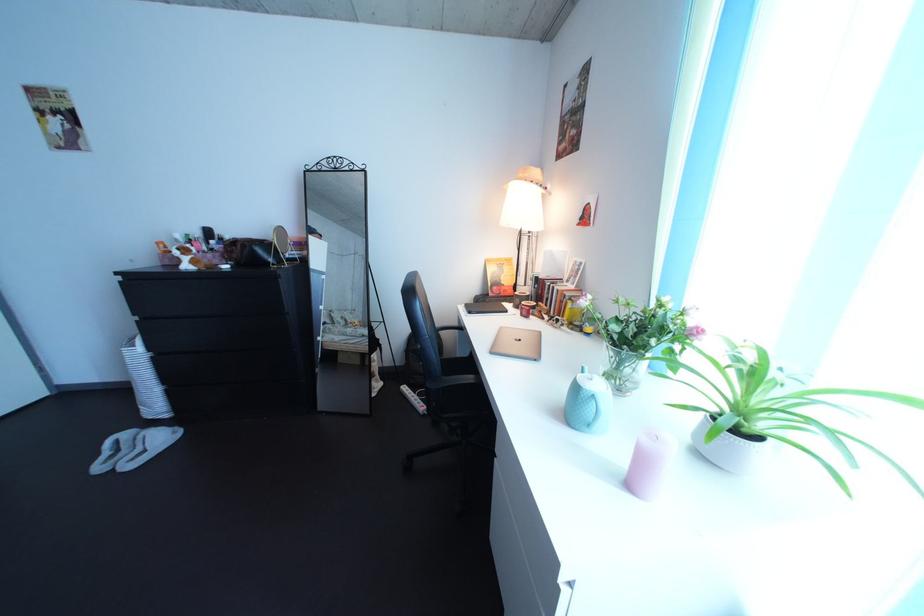
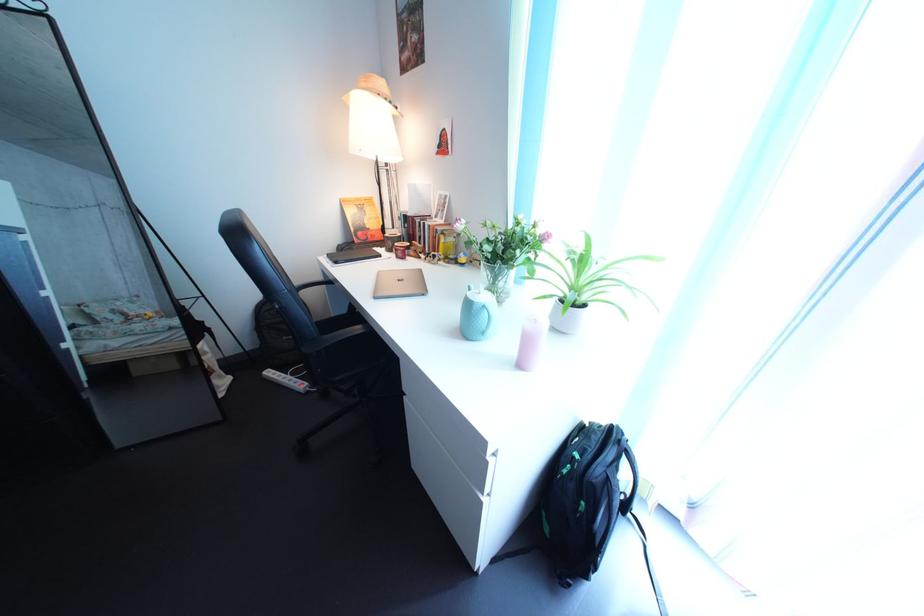
In the second image, find the point that corresponds to (x=590, y=397) in the first image.

(482, 313)